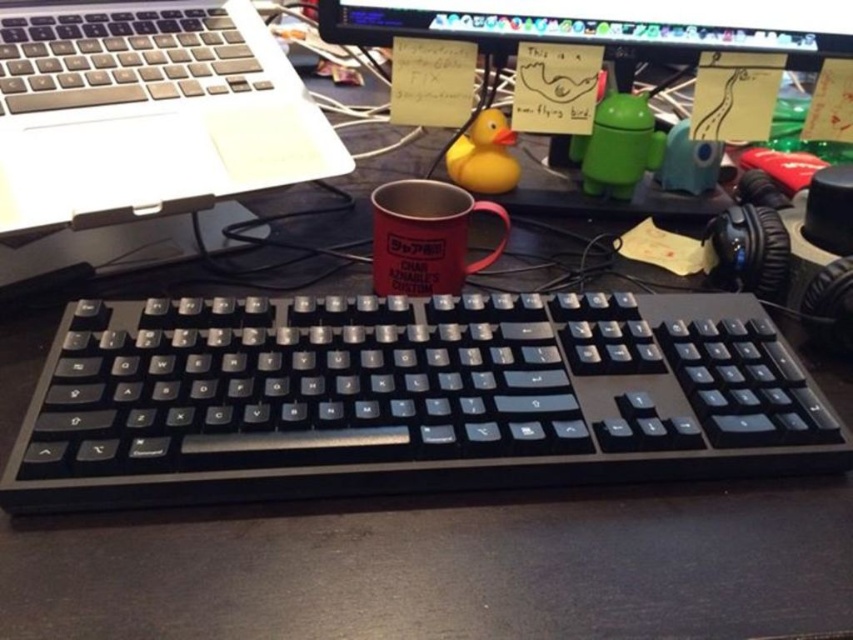
Question: Is black plastic keyboard at center smaller than silver metallic laptop at upper left?

Choices:
 (A) yes
 (B) no

Answer: (A)

Question: Which point is farther from the camera taking this photo?

Choices:
 (A) (80, 312)
 (B) (439, 257)
 (C) (386, 3)

Answer: (C)

Question: Which point appears farthest from the camera in this image?

Choices:
 (A) (447, 280)
 (B) (518, 472)
 (C) (529, 20)

Answer: (C)

Question: Based on their relative distances, which object is farther from the silver metallic laptop at upper left?

Choices:
 (A) matte red mug at center
 (B) matte plastic monitor at upper center
 (C) black plastic keyboard at center

Answer: (C)

Question: Can you confirm if silver metallic laptop at upper left is smaller than matte plastic monitor at upper center?

Choices:
 (A) yes
 (B) no

Answer: (A)

Question: Is silver metallic laptop at upper left further to the viewer compared to matte plastic monitor at upper center?

Choices:
 (A) yes
 (B) no

Answer: (B)